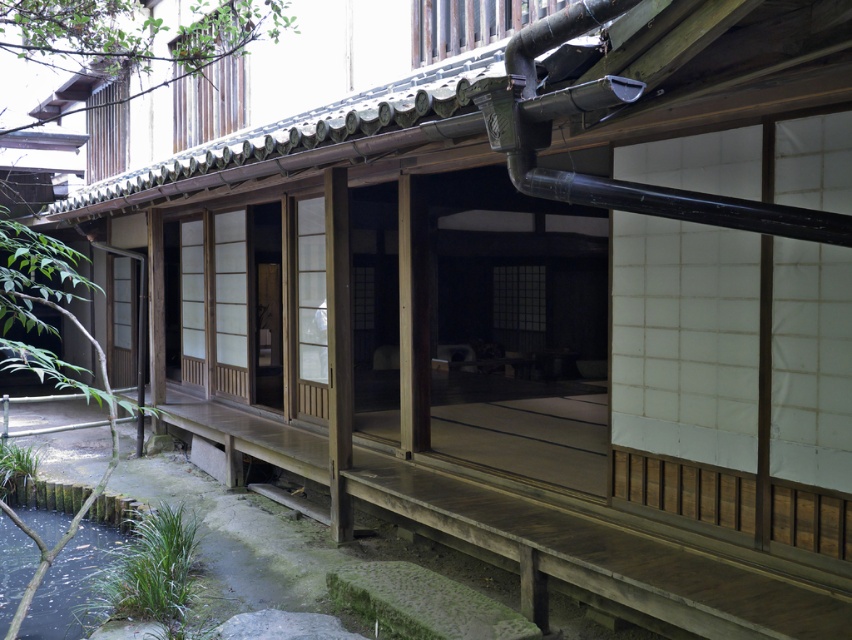
Question: Does green mossy pond at lower left appear under wooden shoji screen at center?

Choices:
 (A) yes
 (B) no

Answer: (A)

Question: Which point is closer to the camera?

Choices:
 (A) wooden shoji screen at center
 (B) green mossy pond at lower left

Answer: (B)

Question: Can you confirm if green mossy pond at lower left is positioned to the right of wooden shoji screen at center?

Choices:
 (A) no
 (B) yes

Answer: (A)

Question: Does green mossy pond at lower left have a lesser width compared to wooden shoji screen at center?

Choices:
 (A) no
 (B) yes

Answer: (A)

Question: Which point is closer to the camera?

Choices:
 (A) (338, 289)
 (B) (44, 525)

Answer: (A)